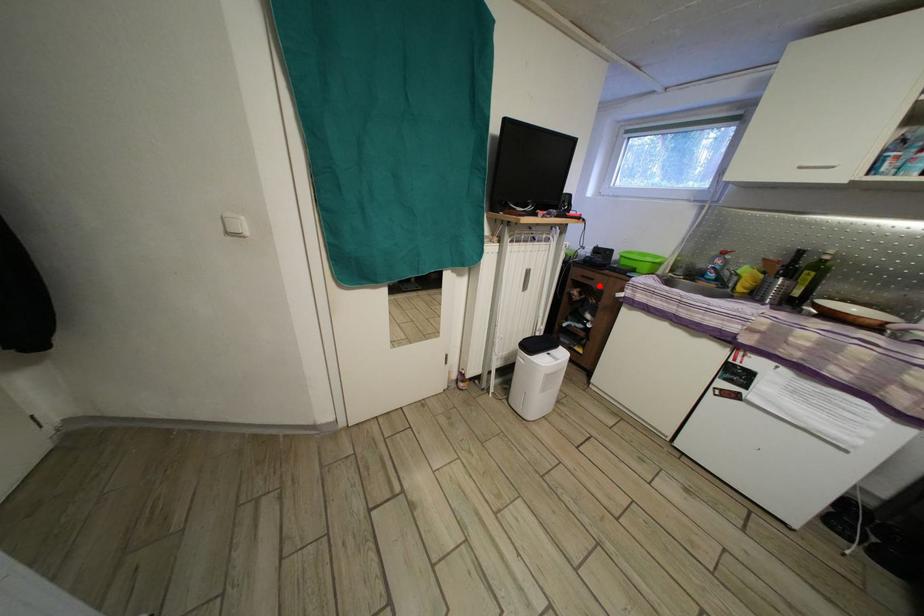
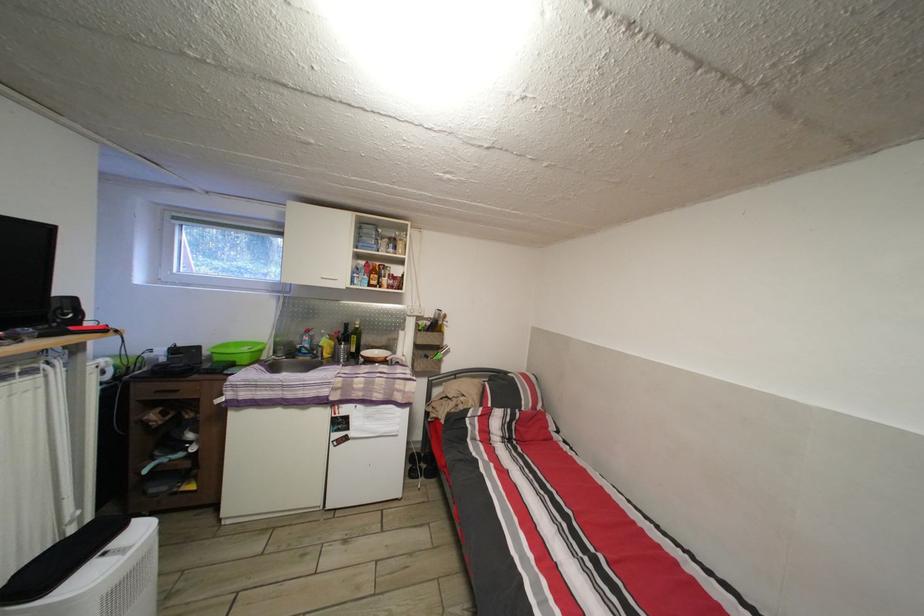
Question: I am providing you with two images of the same scene from different viewpoints. Image1 has a red point marked. In image2, the corresponding 3D location appears at what relative position? Reply with the corresponding letter.

Choices:
 (A) Closer
 (B) Farther

Answer: (B)